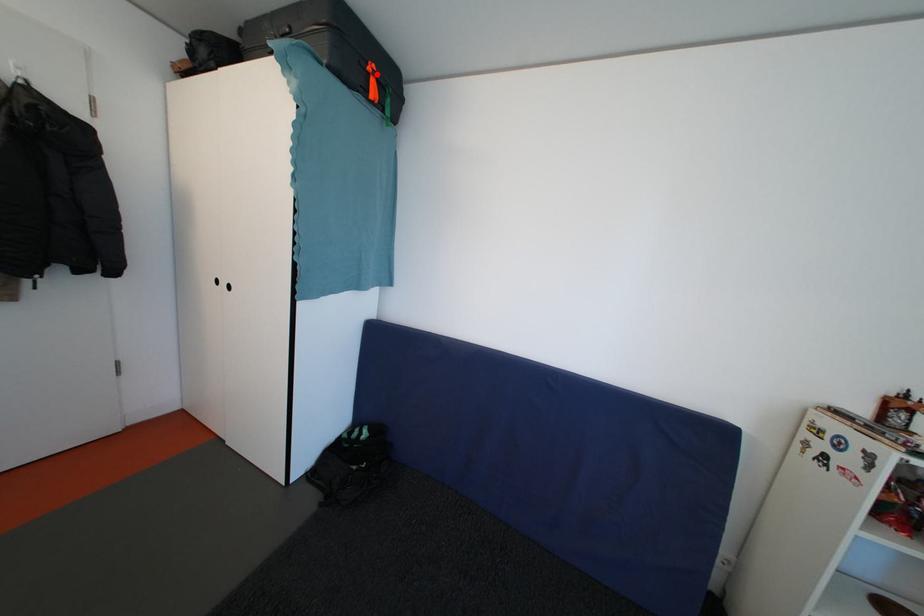
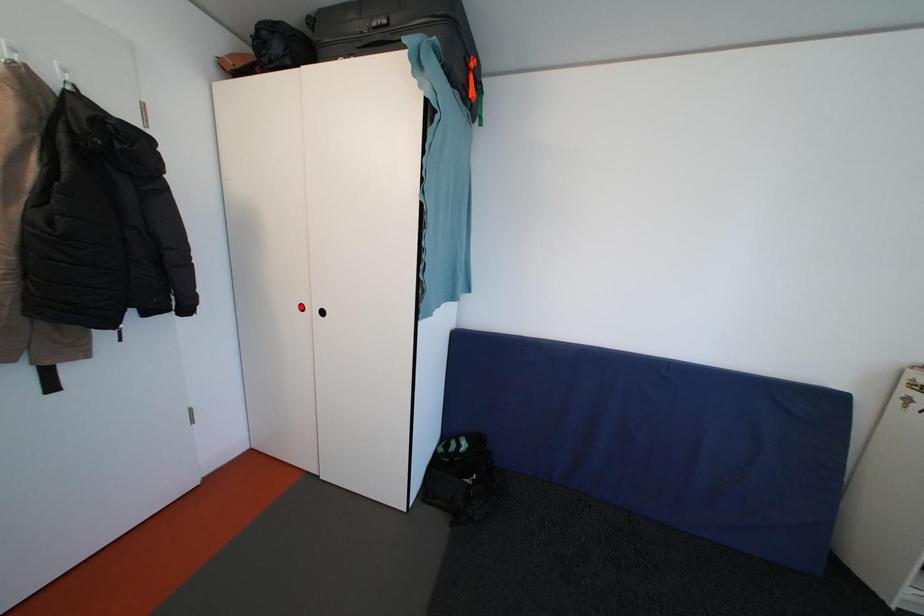
From the picture: I am providing you with two images of the same scene from different viewpoints. A red point is marked on the first image and another point is marked on the second image. Are the points marked in image1 and image2 representing the same 3D position?

No